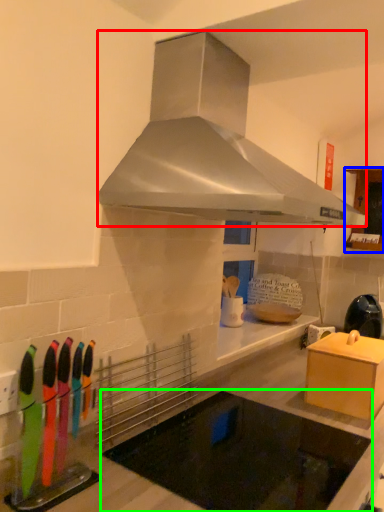
Question: Estimate the real-world distances between objects in this image. Which object is closer to home appliance (highlighted by a red box), cabinetry (highlighted by a blue box) or appliance (highlighted by a green box)?

Choices:
 (A) cabinetry
 (B) appliance

Answer: (B)